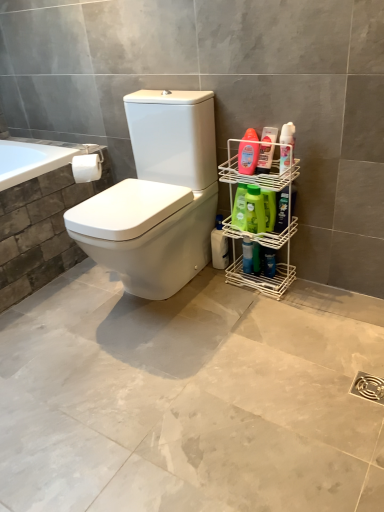
Question: Is point (225, 242) closer or farther from the camera than point (76, 166)?

Choices:
 (A) closer
 (B) farther

Answer: (B)

Question: Would you say white plastic bottle at lower right, the 7th cleaning product when ordered from front to back, is to the left or to the right of white matte toilet paper at upper left in the picture?

Choices:
 (A) left
 (B) right

Answer: (B)

Question: Which object is positioned closest to the green matte bottle at right, marked as the 5th cleaning product in a front-to-back arrangement?

Choices:
 (A) white plastic rack at right
 (B) translucent plastic bottle at right, which is the 6th cleaning product from back to front
 (C) translucent plastic bottle at right, the 7th cleaning product from the back
 (D) translucent plastic bottle at upper right, which is the 1th cleaning product in front-to-back order
 (E) green plastic bottle at center right, which is counted as the fifth cleaning product, starting from the back

Answer: (E)

Question: Considering the real-world distances, which object is closest to the white plastic rack at right?

Choices:
 (A) translucent plastic bottle at right, positioned as the 2th cleaning product in front-to-back order
 (B) blue glossy bottle at lower right
 (C) green plastic bottle at center right, which is counted as the fifth cleaning product, starting from the back
 (D) green matte bottle at right, marked as the 5th cleaning product in a front-to-back arrangement
 (E) translucent plastic bottle at right, which is the 6th cleaning product from back to front

Answer: (C)